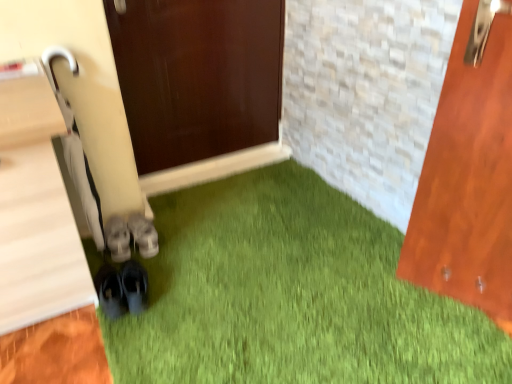
What do you see at coordinates (143, 235) in the screenshot? This screenshot has width=512, height=384. I see `gray suede shoes at center, arranged as the third footwear when viewed from the front` at bounding box center [143, 235].

The height and width of the screenshot is (384, 512). What do you see at coordinates (118, 238) in the screenshot? I see `white leather sneakers at center, the 2th footwear from the front` at bounding box center [118, 238].

Where is `gray suede shoes at center, arranged as the third footwear when viewed from the front`? The height and width of the screenshot is (384, 512). gray suede shoes at center, arranged as the third footwear when viewed from the front is located at coordinates (143, 235).

Is gray suede shoes at center, arranged as the third footwear when viewed from the front, taller or shorter than white leather sneakers at center, the 2th footwear viewed from the back?

Clearly, gray suede shoes at center, arranged as the third footwear when viewed from the front, is shorter compared to white leather sneakers at center, the 2th footwear viewed from the back.

Is gray suede shoes at center, arranged as the third footwear when viewed from the front, smaller than white leather sneakers at center, the 2th footwear viewed from the back?

Incorrect, gray suede shoes at center, arranged as the third footwear when viewed from the front, is not smaller in size than white leather sneakers at center, the 2th footwear viewed from the back.

Is white leather sneakers at center, the 2th footwear viewed from the back, looking in the opposite direction of gray suede shoes at center, which appears as the 1th footwear when viewed from the back?

No.

Would you say white leather sneakers at center, the 2th footwear viewed from the back, contains gray suede shoes at center, arranged as the third footwear when viewed from the front?

That's incorrect, gray suede shoes at center, arranged as the third footwear when viewed from the front, is not inside white leather sneakers at center, the 2th footwear viewed from the back.

Can you confirm if white leather sneakers at center, the 2th footwear viewed from the back, is wider than gray suede shoes at center, which appears as the 1th footwear when viewed from the back?

No, white leather sneakers at center, the 2th footwear viewed from the back, is not wider than gray suede shoes at center, which appears as the 1th footwear when viewed from the back.

Who is bigger, white leather sneakers at center, the 2th footwear from the front, or gray suede shoes at center, arranged as the third footwear when viewed from the front?

Bigger between the two is gray suede shoes at center, arranged as the third footwear when viewed from the front.

Is gray suede shoes at center, arranged as the third footwear when viewed from the front, completely or partially inside black matte shoes at lower left, the first footwear viewed from the front?

No, gray suede shoes at center, arranged as the third footwear when viewed from the front, is located outside of black matte shoes at lower left, the first footwear viewed from the front.

From the image's perspective, is black matte shoes at lower left, the first footwear viewed from the front, over gray suede shoes at center, arranged as the third footwear when viewed from the front?

No, from the image's perspective, black matte shoes at lower left, the first footwear viewed from the front, is not on top of gray suede shoes at center, arranged as the third footwear when viewed from the front.

Between black matte shoes at lower left, marked as the third footwear in a back-to-front arrangement, and gray suede shoes at center, which appears as the 1th footwear when viewed from the back, which one is positioned in front?

black matte shoes at lower left, marked as the third footwear in a back-to-front arrangement, is in front.

Looking at this image, is black matte shoes at lower left, marked as the third footwear in a back-to-front arrangement, turned away from gray suede shoes at center, which appears as the 1th footwear when viewed from the back?

No, black matte shoes at lower left, marked as the third footwear in a back-to-front arrangement, is not facing away from gray suede shoes at center, which appears as the 1th footwear when viewed from the back.

In terms of height, does gray suede shoes at center, which appears as the 1th footwear when viewed from the back, look taller or shorter compared to black matte shoes at lower left, marked as the third footwear in a back-to-front arrangement?

Clearly, gray suede shoes at center, which appears as the 1th footwear when viewed from the back, is shorter compared to black matte shoes at lower left, marked as the third footwear in a back-to-front arrangement.

From the image's perspective, which is above, gray suede shoes at center, which appears as the 1th footwear when viewed from the back, or black matte shoes at lower left, the first footwear viewed from the front?

gray suede shoes at center, which appears as the 1th footwear when viewed from the back.

Is gray suede shoes at center, arranged as the third footwear when viewed from the front, positioned with its back to black matte shoes at lower left, the first footwear viewed from the front?

gray suede shoes at center, arranged as the third footwear when viewed from the front, does not have its back to black matte shoes at lower left, the first footwear viewed from the front.

Is gray suede shoes at center, arranged as the third footwear when viewed from the front, wider than black matte shoes at lower left, the first footwear viewed from the front?

Yes.

Is black matte shoes at lower left, the first footwear viewed from the front, at the left side of white leather sneakers at center, the 2th footwear from the front?

In fact, black matte shoes at lower left, the first footwear viewed from the front, is to the right of white leather sneakers at center, the 2th footwear from the front.

Considering the sizes of black matte shoes at lower left, marked as the third footwear in a back-to-front arrangement, and white leather sneakers at center, the 2th footwear from the front, in the image, is black matte shoes at lower left, marked as the third footwear in a back-to-front arrangement, bigger or smaller than white leather sneakers at center, the 2th footwear from the front,?

In the image, black matte shoes at lower left, marked as the third footwear in a back-to-front arrangement, appears to be larger than white leather sneakers at center, the 2th footwear from the front.

Which is closer to the camera, (99, 279) or (122, 226)?

Point (99, 279) is closer to the camera than point (122, 226).

From the picture: Does white leather sneakers at center, the 2th footwear viewed from the back, turn towards black matte shoes at lower left, marked as the third footwear in a back-to-front arrangement?

No, white leather sneakers at center, the 2th footwear viewed from the back, is not facing towards black matte shoes at lower left, marked as the third footwear in a back-to-front arrangement.

From a real-world perspective, between white leather sneakers at center, the 2th footwear from the front, and black matte shoes at lower left, the first footwear viewed from the front, who is vertically lower?

white leather sneakers at center, the 2th footwear from the front, is physically lower.

Based on the photo, can you confirm if white leather sneakers at center, the 2th footwear viewed from the back, is shorter than black matte shoes at lower left, the first footwear viewed from the front?

Yes, white leather sneakers at center, the 2th footwear viewed from the back, is shorter than black matte shoes at lower left, the first footwear viewed from the front.

Is white leather sneakers at center, the 2th footwear from the front, positioned beyond the bounds of black matte shoes at lower left, marked as the third footwear in a back-to-front arrangement?

Yes.

You are a GUI agent. You are given a task and a screenshot of the screen. Output one action in this format:
    pyautogui.click(x=<x>, y=<y>)
    Task: Click on the footwear behind the white leather sneakers at center, the 2th footwear viewed from the back
    The image size is (512, 384).
    Given the screenshot: What is the action you would take?
    pyautogui.click(x=143, y=235)

This screenshot has width=512, height=384. I want to click on footwear that is the 1st object located in front of the gray suede shoes at center, arranged as the third footwear when viewed from the front, so click(x=118, y=238).

When comparing their distances from black matte shoes at lower left, marked as the third footwear in a back-to-front arrangement, does white leather sneakers at center, the 2th footwear from the front, or gray suede shoes at center, which appears as the 1th footwear when viewed from the back, seem further?

Based on the image, gray suede shoes at center, which appears as the 1th footwear when viewed from the back, appears to be further to black matte shoes at lower left, marked as the third footwear in a back-to-front arrangement.

Looking at the image, which one is located further to white leather sneakers at center, the 2th footwear viewed from the back, gray suede shoes at center, which appears as the 1th footwear when viewed from the back, or black matte shoes at lower left, the first footwear viewed from the front?

Among the two, black matte shoes at lower left, the first footwear viewed from the front, is located further to white leather sneakers at center, the 2th footwear viewed from the back.

Considering their positions, is black matte shoes at lower left, the first footwear viewed from the front, positioned closer to white leather sneakers at center, the 2th footwear viewed from the back, than gray suede shoes at center, arranged as the third footwear when viewed from the front?

The object closer to white leather sneakers at center, the 2th footwear viewed from the back, is gray suede shoes at center, arranged as the third footwear when viewed from the front.

When comparing their distances from black matte shoes at lower left, the first footwear viewed from the front, does gray suede shoes at center, arranged as the third footwear when viewed from the front, or white leather sneakers at center, the 2th footwear viewed from the back, seem further?

Among the two, gray suede shoes at center, arranged as the third footwear when viewed from the front, is located further to black matte shoes at lower left, the first footwear viewed from the front.

From the image, which object appears to be nearer to gray suede shoes at center, which appears as the 1th footwear when viewed from the back, black matte shoes at lower left, marked as the third footwear in a back-to-front arrangement, or white leather sneakers at center, the 2th footwear from the front?

The object closer to gray suede shoes at center, which appears as the 1th footwear when viewed from the back, is white leather sneakers at center, the 2th footwear from the front.

From the image, which object appears to be nearer to gray suede shoes at center, arranged as the third footwear when viewed from the front, white leather sneakers at center, the 2th footwear viewed from the back, or black matte shoes at lower left, the first footwear viewed from the front?

white leather sneakers at center, the 2th footwear viewed from the back, is closer to gray suede shoes at center, arranged as the third footwear when viewed from the front.

Identify the location of footwear located between black matte shoes at lower left, the first footwear viewed from the front, and gray suede shoes at center, arranged as the third footwear when viewed from the front, in the depth direction. [x=118, y=238].